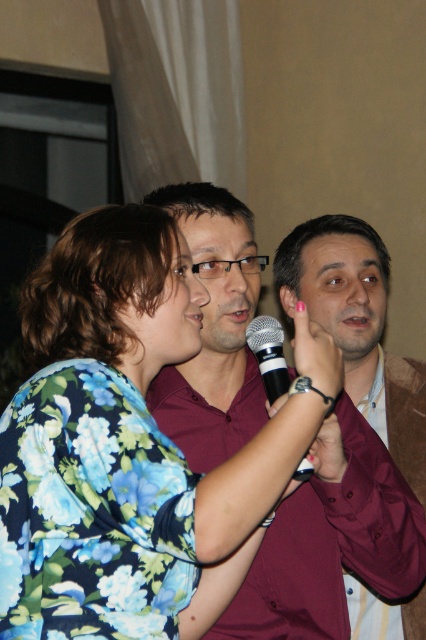
Who is more forward, (75, 561) or (288, 381)?

Point (75, 561) is more forward.

Is point (138, 605) positioned before point (259, 353)?

Yes, point (138, 605) is in front of point (259, 353).

At what (x,y) coordinates should I click in order to perform the action: click on floral fabric shirt at center. Please return your answer as a coordinate pair (x, y). Looking at the image, I should click on (124, 440).

Can you confirm if maroon shirt at center is positioned above black matte microphone at center?

Actually, maroon shirt at center is below black matte microphone at center.

At what (x,y) coordinates should I click in order to perform the action: click on maroon shirt at center. Please return your answer as a coordinate pair (x, y). The width and height of the screenshot is (426, 640). Looking at the image, I should click on (331, 547).

At what (x,y) coordinates should I click in order to perform the action: click on maroon shirt at center. Please return your answer as a coordinate pair (x, y). Image resolution: width=426 pixels, height=640 pixels. Looking at the image, I should click on (331, 547).

Does floral fabric shirt at center have a larger size compared to maroon shirt at center?

Yes.

Is point (172, 228) positioned before point (229, 452)?

Yes, it is in front of point (229, 452).

Locate an element on the screen. floral fabric shirt at center is located at coordinates (124, 440).